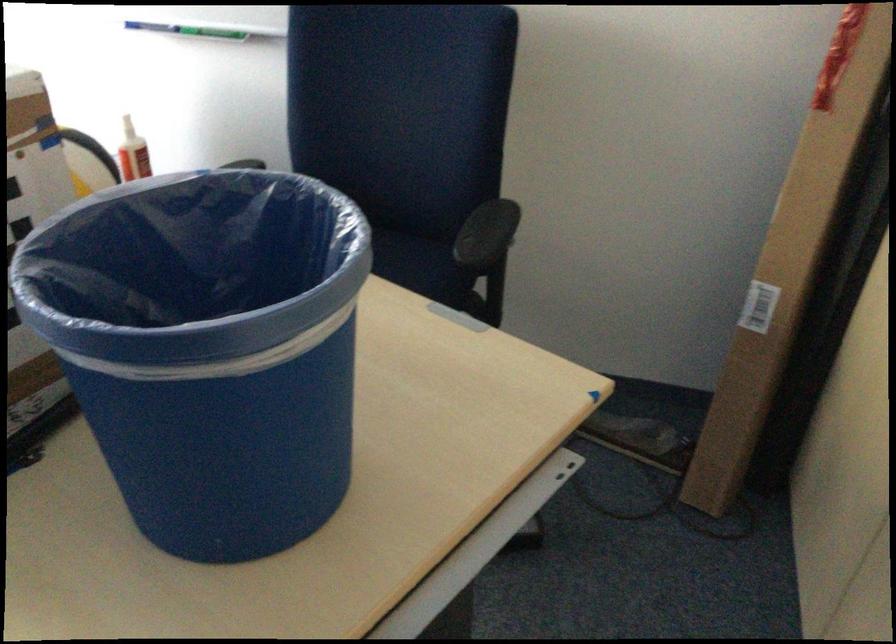
Describe the element at coordinates (395, 261) in the screenshot. The width and height of the screenshot is (896, 644). I see `the chair sitting surface` at that location.